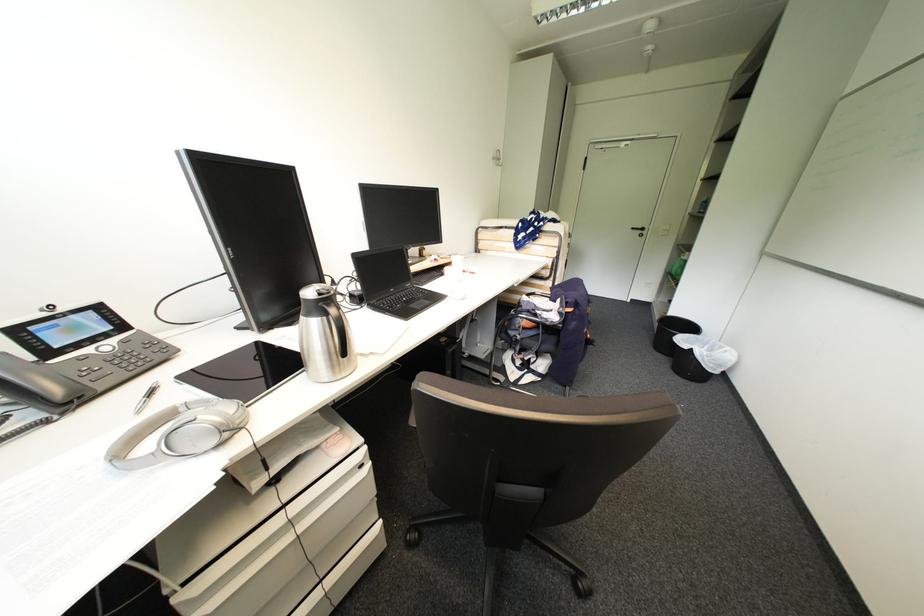
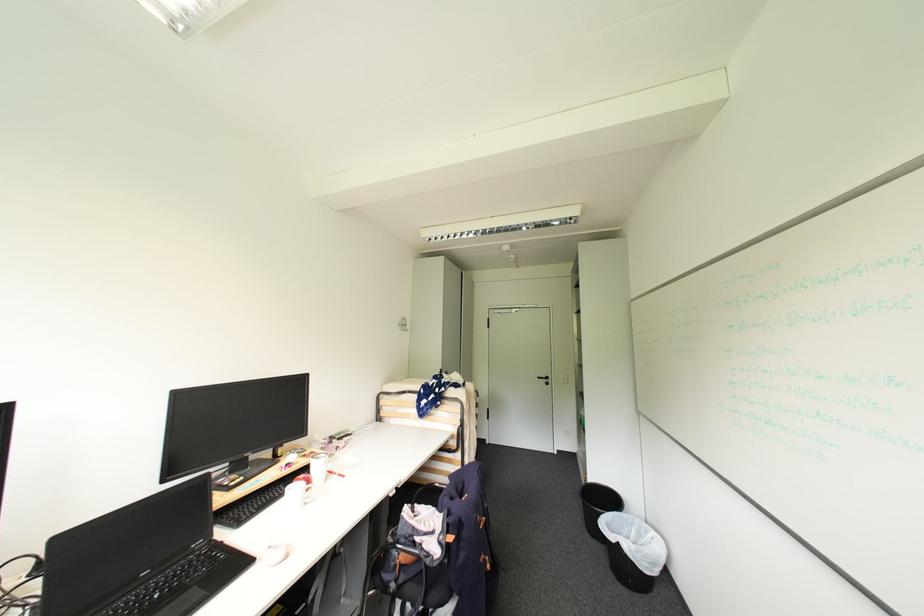
Find the pixel in the second image that matches (x=639, y=230) in the first image.

(544, 379)